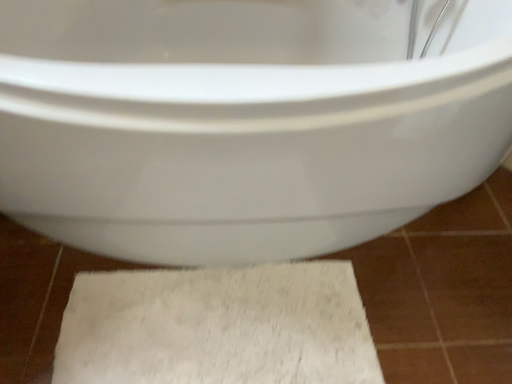
Question: Is white fluffy bath mat at lower center closer to camera compared to white glossy toilet at center?

Choices:
 (A) no
 (B) yes

Answer: (A)

Question: Does white fluffy bath mat at lower center touch white glossy toilet at center?

Choices:
 (A) yes
 (B) no

Answer: (B)

Question: Would you say white glossy toilet at center is part of white fluffy bath mat at lower center's contents?

Choices:
 (A) yes
 (B) no

Answer: (B)

Question: Is white fluffy bath mat at lower center bigger than white glossy toilet at center?

Choices:
 (A) yes
 (B) no

Answer: (B)

Question: Does white fluffy bath mat at lower center appear on the left side of white glossy toilet at center?

Choices:
 (A) no
 (B) yes

Answer: (B)

Question: Is white fluffy bath mat at lower center thinner than white glossy toilet at center?

Choices:
 (A) no
 (B) yes

Answer: (B)

Question: Is white glossy toilet at center far away from white fluffy bath mat at lower center?

Choices:
 (A) no
 (B) yes

Answer: (A)

Question: Does white glossy toilet at center have a lesser width compared to white fluffy bath mat at lower center?

Choices:
 (A) no
 (B) yes

Answer: (A)

Question: From a real-world perspective, is white glossy toilet at center physically above white fluffy bath mat at lower center?

Choices:
 (A) no
 (B) yes

Answer: (B)

Question: Is white glossy toilet at center facing towards white fluffy bath mat at lower center?

Choices:
 (A) no
 (B) yes

Answer: (A)

Question: Is white glossy toilet at center at the right side of white fluffy bath mat at lower center?

Choices:
 (A) yes
 (B) no

Answer: (A)

Question: From the image's perspective, is white glossy toilet at center over white fluffy bath mat at lower center?

Choices:
 (A) no
 (B) yes

Answer: (B)

Question: In terms of width, does white glossy toilet at center look wider or thinner when compared to white fluffy bath mat at lower center?

Choices:
 (A) wide
 (B) thin

Answer: (A)